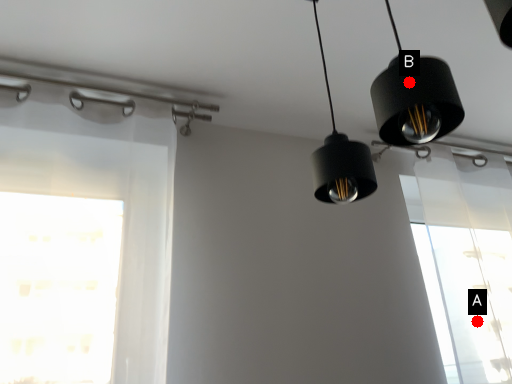
Question: Two points are circled on the image, labeled by A and B beside each circle. Which point appears farthest from the camera in this image?

Choices:
 (A) A is further
 (B) B is further

Answer: (A)